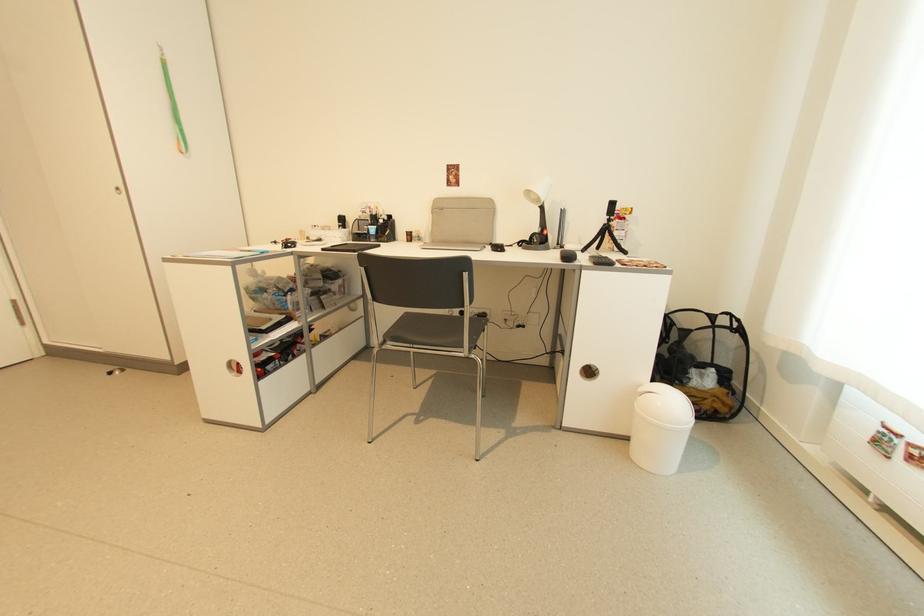
Where would you sit the black chair sitting surface? Please return your answer as a coordinate pair (x, y).

(428, 330)